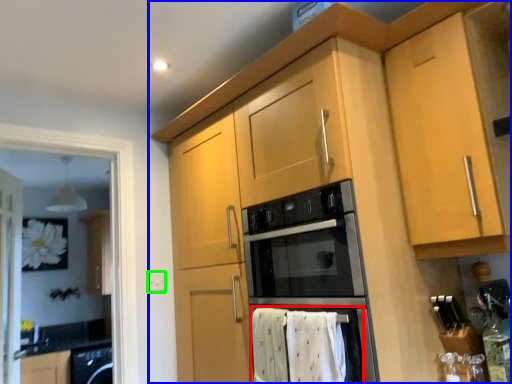
Question: Based on their relative distances, which object is nearer to bath towel (highlighted by a red box)? Choose from cabinetry (highlighted by a blue box) and electric outlet (highlighted by a green box).

Choices:
 (A) cabinetry
 (B) electric outlet

Answer: (A)